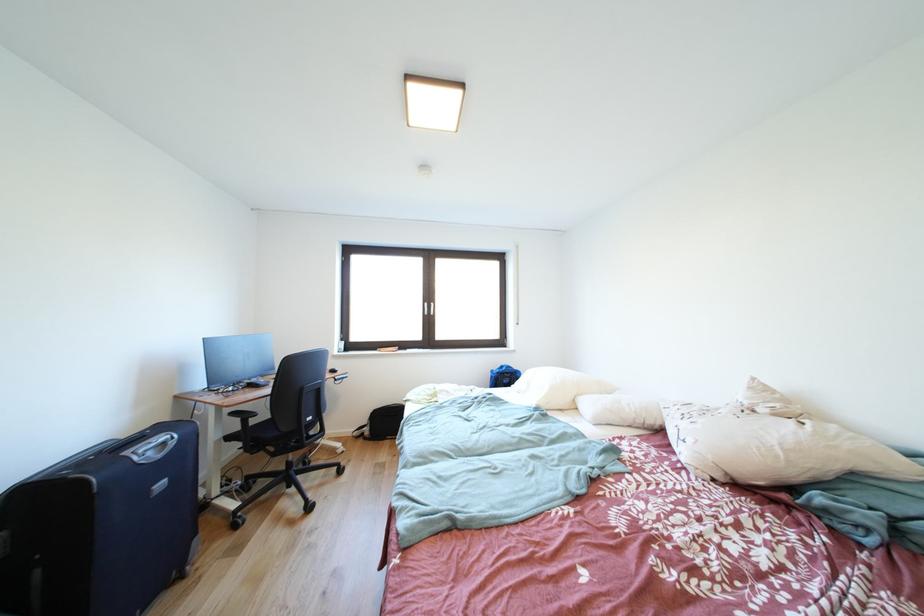
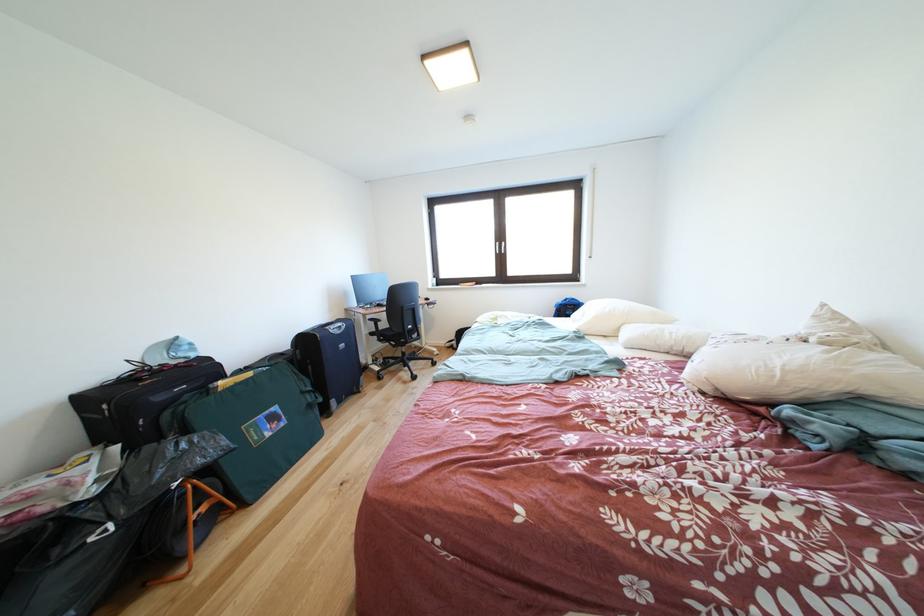
In the second image, find the point that corresponds to (283,459) in the first image.

(403, 351)